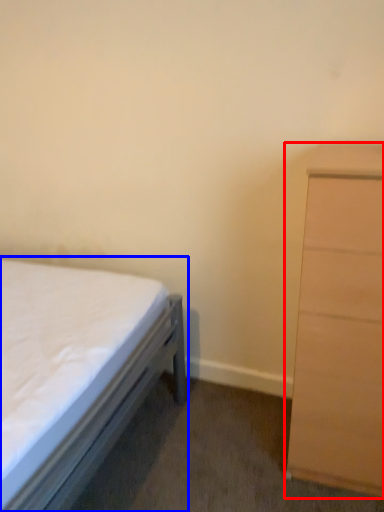
Question: Which object appears farthest to the camera in this image, chest of drawers (highlighted by a red box) or bed (highlighted by a blue box)?

Choices:
 (A) chest of drawers
 (B) bed

Answer: (A)